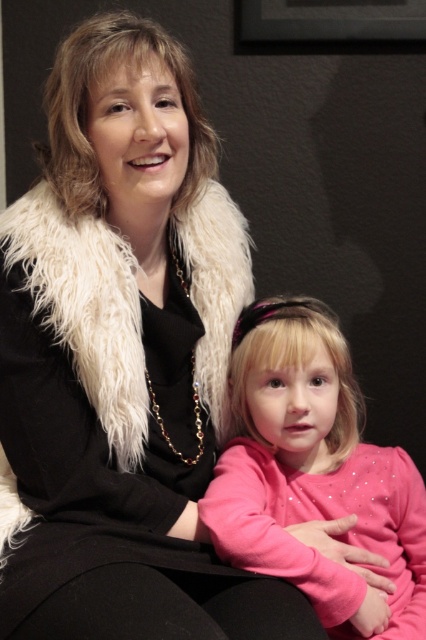
You are a photographer preparing to take a group photo. You have two items to place in the frame for a photo shoot. The pink glittery sweater at center and the white fluffy fur coat at upper left. The photo requires that the narrower item must be placed on the left side of the frame. Based on their widths, which item should you place on the left?

The pink glittery sweater at center has a smaller width than the white fluffy fur coat at upper left, so it should be placed on the left side of the frame to meet the requirement.

Looking at this image, you are an AI analyzing a photo. The scene shows two people sitting together. There is a point marked at coordinates (314, 474). What object is located at this point?

The point at coordinates (314, 474) marks the pink glittery sweater at center.